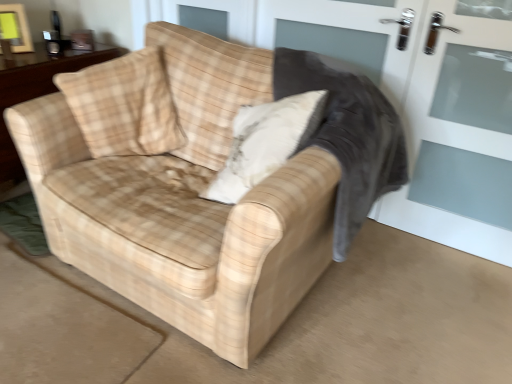
Question: From a real-world perspective, is white glass screen door at right positioned above or below wooden table at center?

Choices:
 (A) below
 (B) above

Answer: (B)

Question: From the image's perspective, relative to wooden table at center, is white glass screen door at right above or below?

Choices:
 (A) below
 (B) above

Answer: (A)

Question: Which is nearer to the plaid fabric rocking chair at center?

Choices:
 (A) beige plaid fabric couch at center
 (B) wooden table at center
 (C) beige plaid throw pillow at upper left, which ranks as the 1th throw pillow in left-to-right order
 (D) white glass screen door at right
 (E) beige plaid throw pillow at center, placed as the 1th throw pillow when sorted from right to left

Answer: (E)

Question: Which object is the closest to the wooden table at center?

Choices:
 (A) beige plaid throw pillow at center, which is counted as the second throw pillow, starting from the left
 (B) plaid fabric rocking chair at center
 (C) beige plaid throw pillow at upper left, acting as the 2th throw pillow starting from the right
 (D) beige plaid fabric couch at center
 (E) white glass screen door at right

Answer: (C)